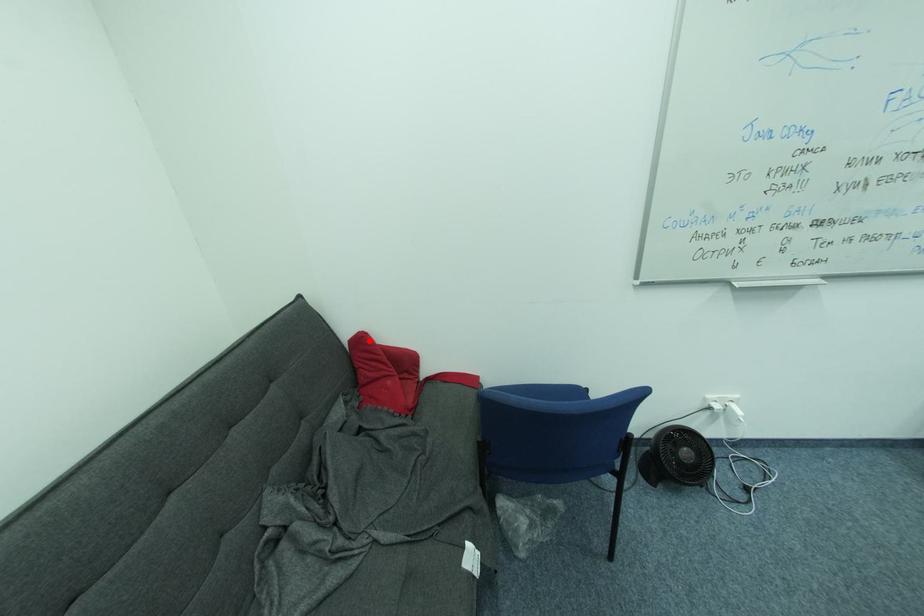
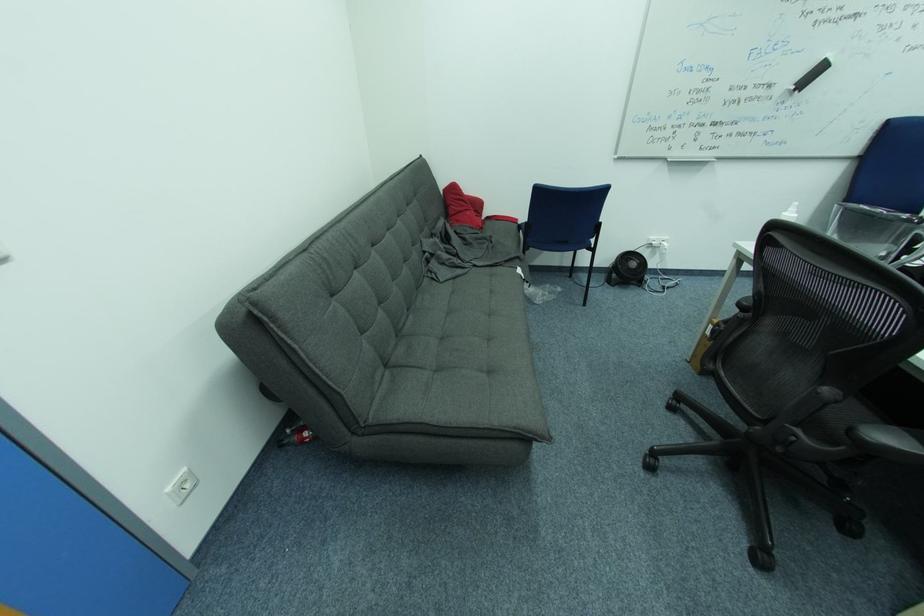
Question: I am providing you with two images of the same scene from different viewpoints. A red point is shown in image1. For the corresponding object point in image2, is it positioned nearer or farther from the camera?

Choices:
 (A) Nearer
 (B) Farther

Answer: (A)